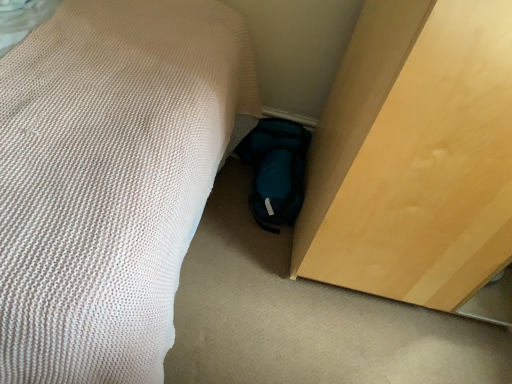
Question: From the image's perspective, is light wood cabinet at lower right on white textured bed at lower left?

Choices:
 (A) yes
 (B) no

Answer: (B)

Question: Is light wood cabinet at lower right far from white textured bed at lower left?

Choices:
 (A) no
 (B) yes

Answer: (A)

Question: Can you confirm if light wood cabinet at lower right is positioned to the left of white textured bed at lower left?

Choices:
 (A) yes
 (B) no

Answer: (B)

Question: Does light wood cabinet at lower right lie behind white textured bed at lower left?

Choices:
 (A) no
 (B) yes

Answer: (B)

Question: Considering the relative sizes of light wood cabinet at lower right and white textured bed at lower left in the image provided, is light wood cabinet at lower right thinner than white textured bed at lower left?

Choices:
 (A) yes
 (B) no

Answer: (A)

Question: Can you confirm if light wood cabinet at lower right is shorter than white textured bed at lower left?

Choices:
 (A) yes
 (B) no

Answer: (B)

Question: From a real-world perspective, is white textured bed at lower left below light wood cabinet at lower right?

Choices:
 (A) yes
 (B) no

Answer: (A)

Question: From the image's perspective, would you say white textured bed at lower left is shown under light wood cabinet at lower right?

Choices:
 (A) no
 (B) yes

Answer: (A)

Question: Is white textured bed at lower left to the right of light wood cabinet at lower right from the viewer's perspective?

Choices:
 (A) no
 (B) yes

Answer: (A)

Question: Can you confirm if white textured bed at lower left is bigger than light wood cabinet at lower right?

Choices:
 (A) no
 (B) yes

Answer: (B)

Question: Does white textured bed at lower left come in front of light wood cabinet at lower right?

Choices:
 (A) no
 (B) yes

Answer: (B)

Question: Is white textured bed at lower left beside light wood cabinet at lower right?

Choices:
 (A) no
 (B) yes

Answer: (A)

Question: Can you confirm if teal fabric slipper at lower center is positioned to the left of light wood cabinet at lower right?

Choices:
 (A) yes
 (B) no

Answer: (A)